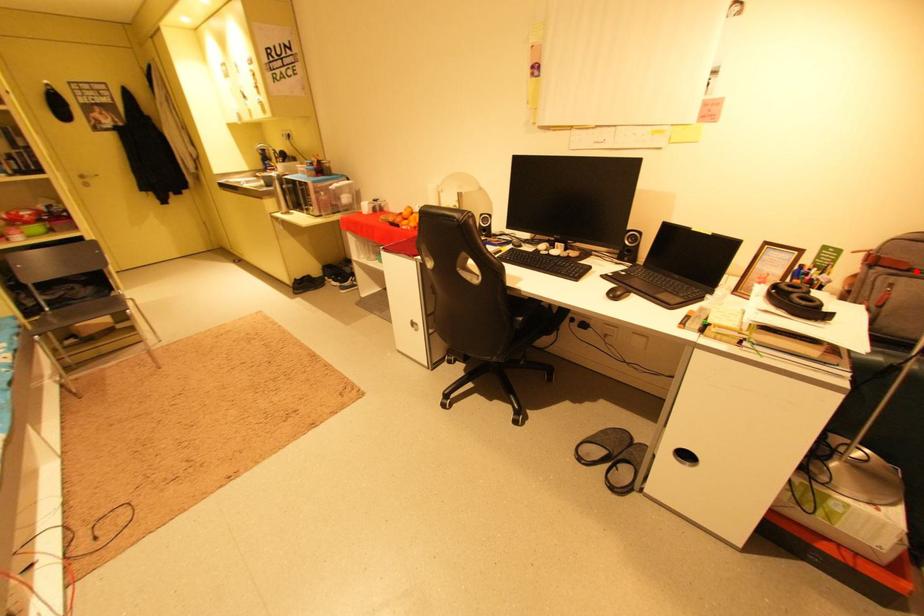
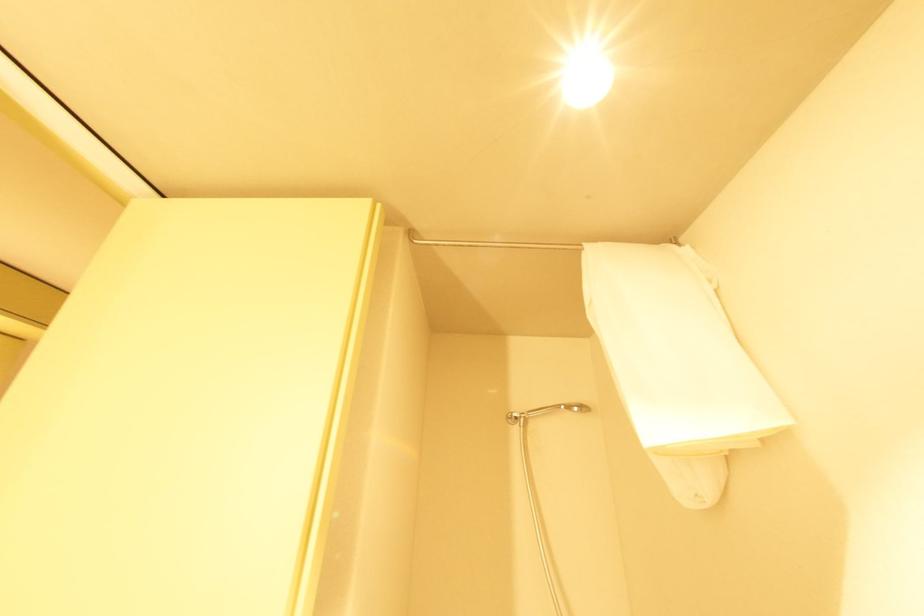
Question: I am providing you with two images of the same scene from different viewpoints. A red point is marked on the first image. At the location where the point appears in image 1, is it still visible in image 2?

Choices:
 (A) Yes
 (B) No

Answer: (B)